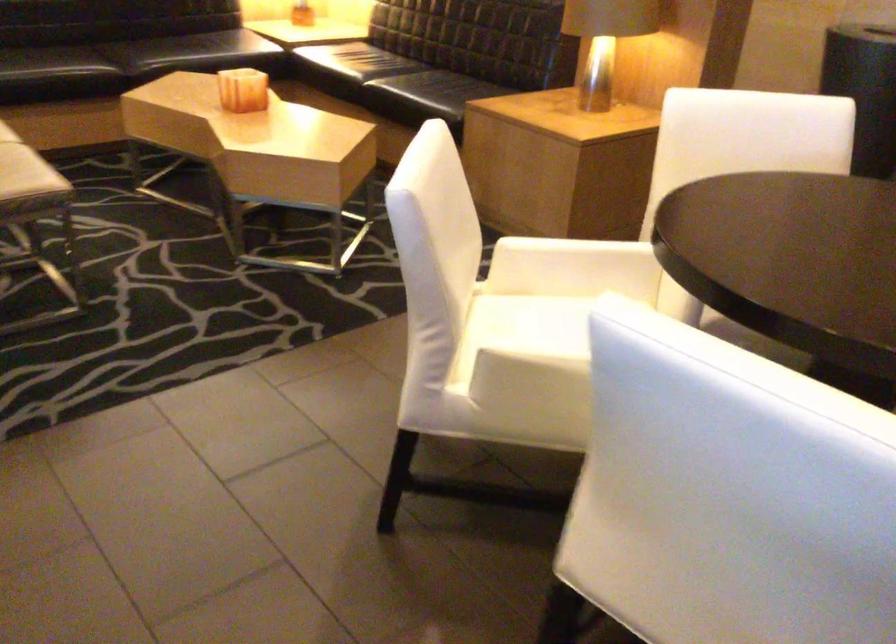
You are a GUI agent. You are given a task and a screenshot of the screen. Output one action in this format:
    pyautogui.click(x=<x>, y=<y>)
    Task: Click on the white chair sitting surface
    
    Given the screenshot: What is the action you would take?
    pyautogui.click(x=538, y=304)